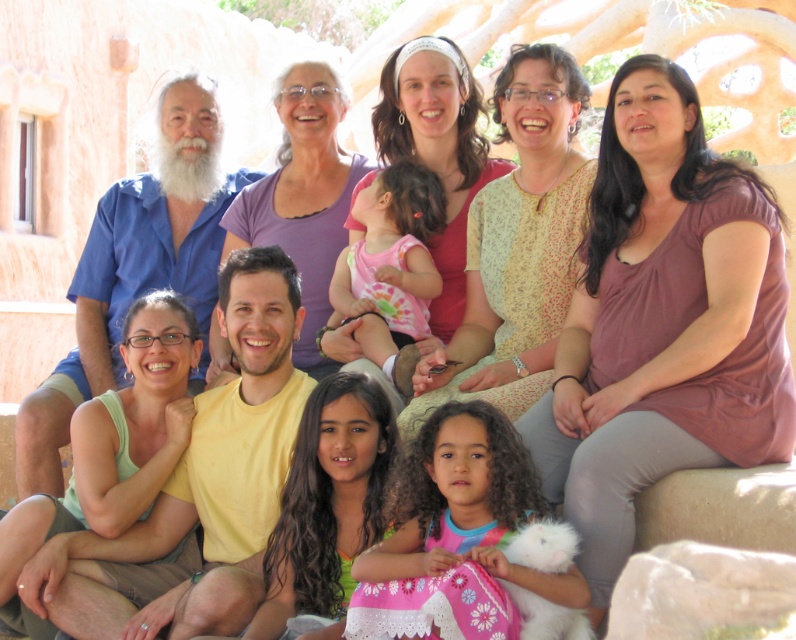
You are a photographer standing at the camera position. You want to take a closeup photo of the purple satin blouse at center. Considering the distance, can you get a clear photo without zooming?

The purple satin blouse at center is 36.03 meters away from the camera, so it is too far to capture a clear closeup without zooming.